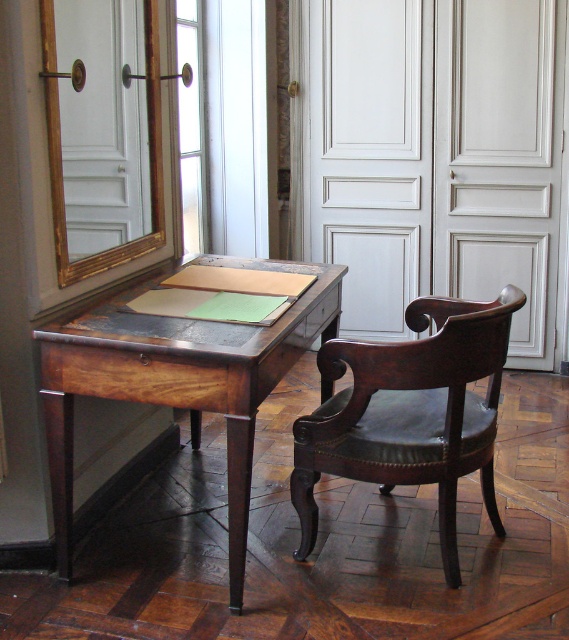
The image size is (569, 640). What do you see at coordinates (179, 380) in the screenshot?
I see `mahogany wood desk at center` at bounding box center [179, 380].

Who is more forward, (236,355) or (440,321)?

Positioned in front is point (236,355).

Identify the location of mahogany wood desk at center. (179, 380).